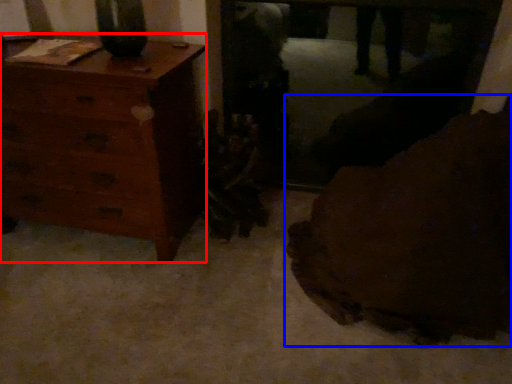
Question: Which point is closer to the camera, chest of drawers (highlighted by a red box) or furniture (highlighted by a blue box)?

Choices:
 (A) chest of drawers
 (B) furniture

Answer: (B)